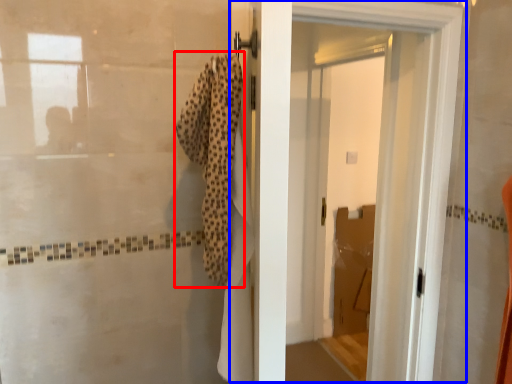
Question: Which object is closer to the camera taking this photo, bath towel (highlighted by a red box) or door (highlighted by a blue box)?

Choices:
 (A) bath towel
 (B) door

Answer: (A)